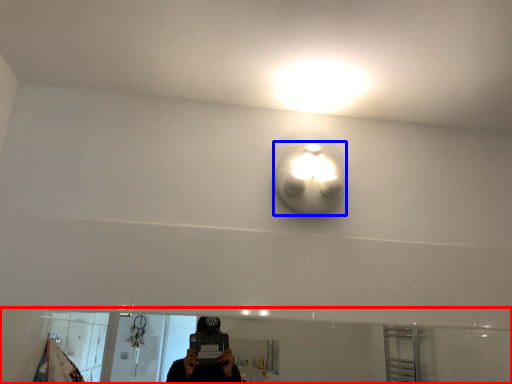
Question: Which of the following is the closest to the observer, mirror (highlighted by a red box) or light (highlighted by a blue box)?

Choices:
 (A) mirror
 (B) light

Answer: (A)